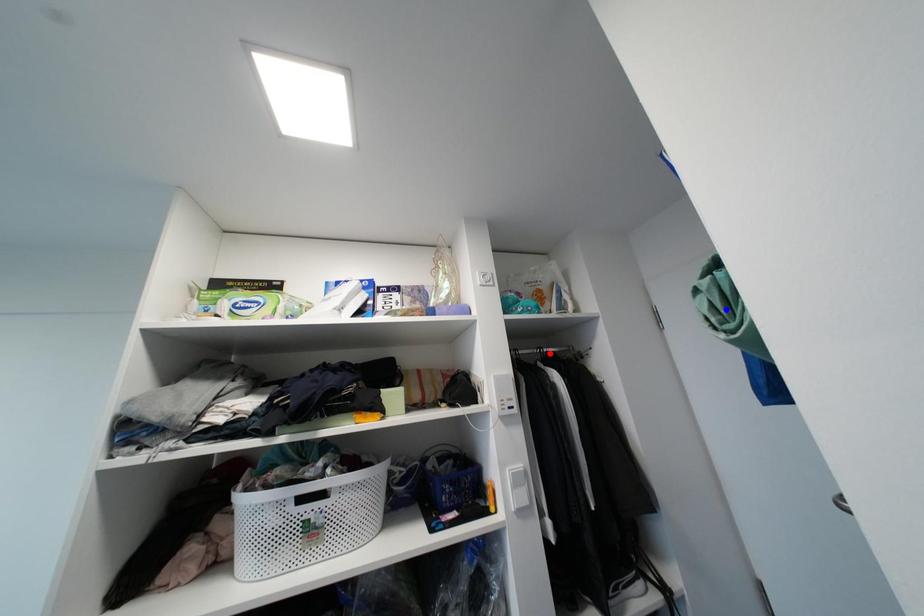
Question: Which of the two points in the image is closer to the camera?

Choices:
 (A) Blue point is closer.
 (B) Red point is closer.

Answer: (A)